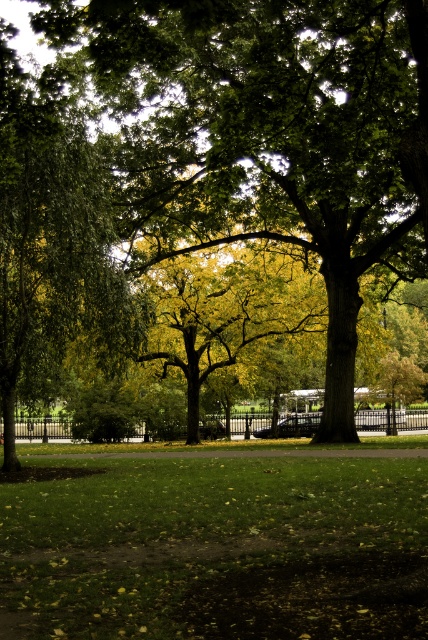
Is green leafy tree at center further to the viewer compared to green grass at center?

Yes, it is behind green grass at center.

Is point (374, 115) less distant than point (323, 618)?

No.

Which is behind, point (332, 129) or point (83, 461)?

Positioned behind is point (83, 461).

Find the location of a particular element. This screenshot has height=640, width=428. green leafy tree at center is located at coordinates (264, 134).